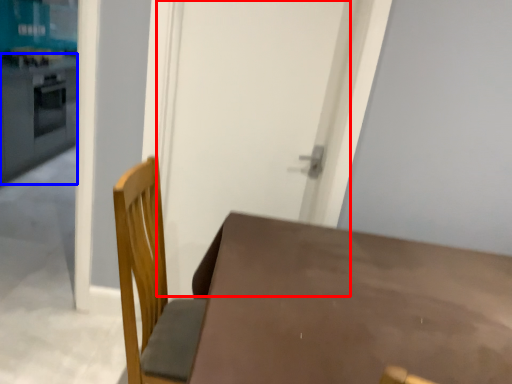
Question: Which point is further to the camera, screen door (highlighted by a red box) or counter top (highlighted by a blue box)?

Choices:
 (A) screen door
 (B) counter top

Answer: (B)